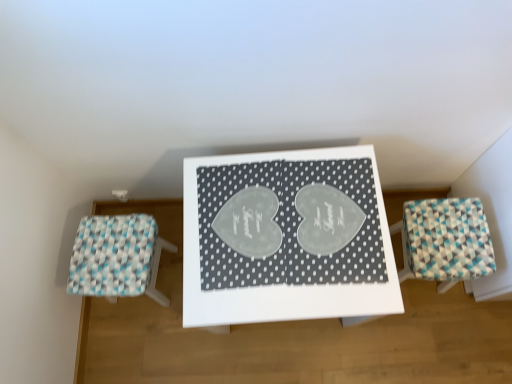
Question: Looking at their shapes, would you say white glossy table at center is wider or thinner than white woven stool at left, the 1th furniture viewed from the left?

Choices:
 (A) thin
 (B) wide

Answer: (B)

Question: Looking at the image, does white glossy table at center seem bigger or smaller compared to white woven stool at left, the 1th furniture viewed from the left?

Choices:
 (A) big
 (B) small

Answer: (A)

Question: Considering the real-world distances, which object is farthest from the teal-patterned stool at right, placed as the 2th furniture when sorted from left to right?

Choices:
 (A) white glossy table at center
 (B) white woven stool at left, the 1th furniture viewed from the left

Answer: (B)

Question: Which is nearer to the white woven stool at left, the 1th furniture viewed from the left?

Choices:
 (A) teal-patterned stool at right, placed as the 2th furniture when sorted from left to right
 (B) white glossy table at center

Answer: (B)